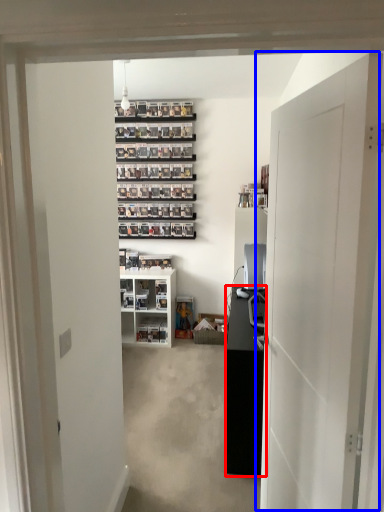
Question: Which object appears closest to the camera in this image, cabinetry (highlighted by a red box) or door (highlighted by a blue box)?

Choices:
 (A) cabinetry
 (B) door

Answer: (B)